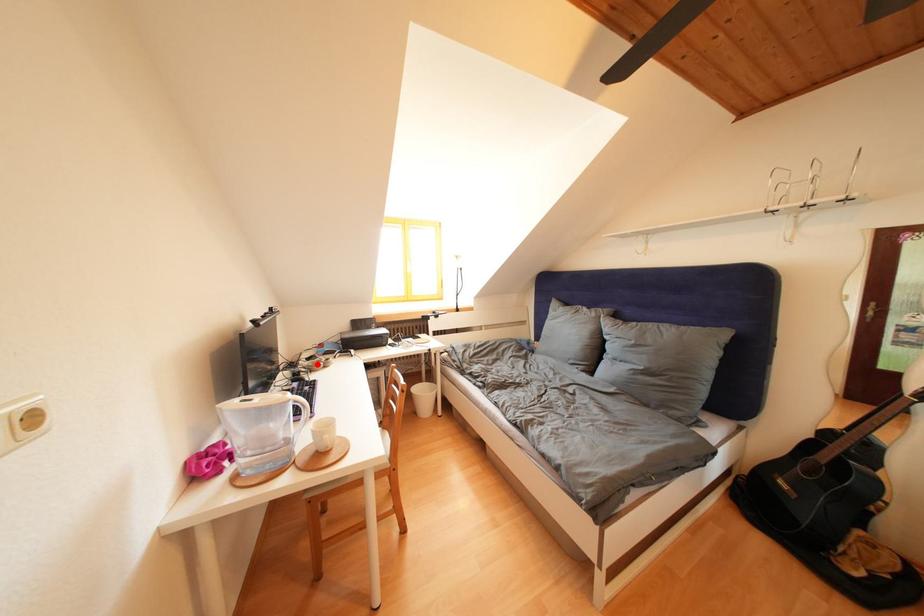
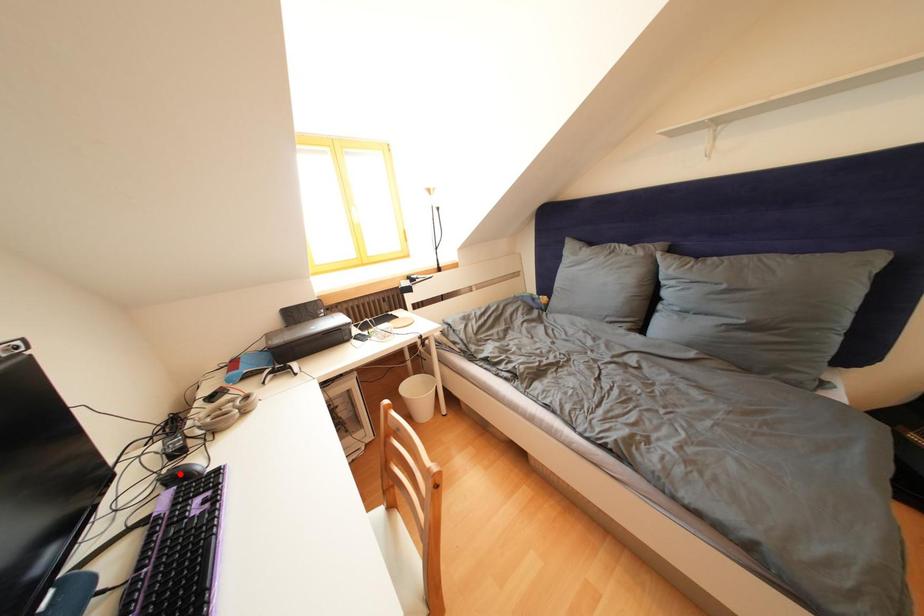
I am providing you with two images of the same scene from different viewpoints. A red point is marked on the first image and another point is marked on the second image. Is the red point in image1 aligned with the point shown in image2?

No